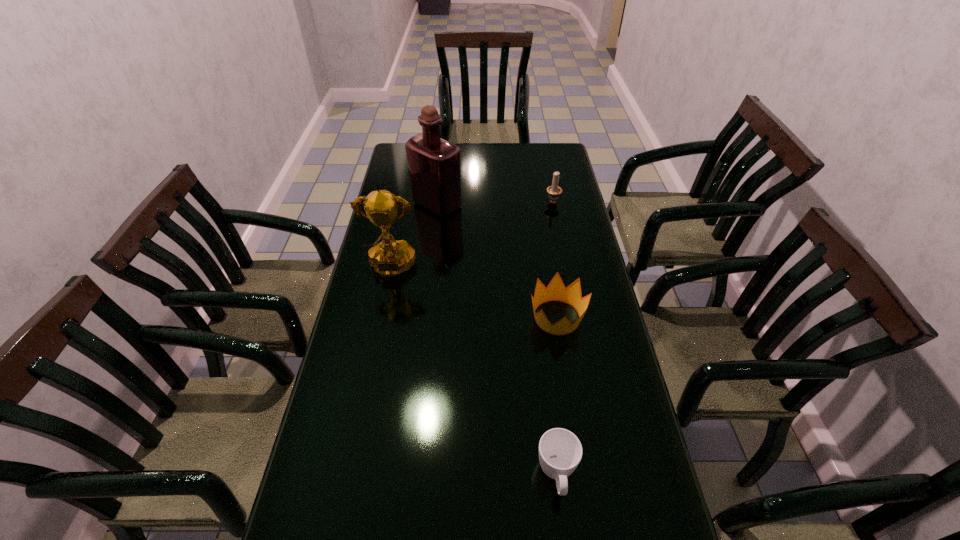
Find the location of a particular element. vacant space at the far right corner of the desktop is located at coordinates point(565,168).

Where is `free spot between the candle_holder and the liquor`? The image size is (960, 540). free spot between the candle_holder and the liquor is located at coordinates (495, 202).

The image size is (960, 540). I want to click on free spot between the liquor and the crown, so click(497, 261).

Locate an element on the screen. The width and height of the screenshot is (960, 540). empty location between the cup and the second nearest object is located at coordinates (557, 396).

I want to click on free space between the candle_holder and the crown, so click(x=555, y=259).

Where is `free space that is in between the crown and the liquor`? This screenshot has width=960, height=540. free space that is in between the crown and the liquor is located at coordinates (497, 261).

The width and height of the screenshot is (960, 540). I want to click on free point between the candle_holder and the fourth farthest object, so click(555, 259).

At what (x,y) coordinates should I click in order to perform the action: click on free space between the award and the nearest object. Please return your answer as a coordinate pair (x, y). Looking at the image, I should click on (474, 372).

Image resolution: width=960 pixels, height=540 pixels. Find the location of `unoccupied area between the third nearest object and the tallest object`. unoccupied area between the third nearest object and the tallest object is located at coordinates (414, 237).

Locate an element on the screen. free spot between the nearest object and the second nearest object is located at coordinates (557, 396).